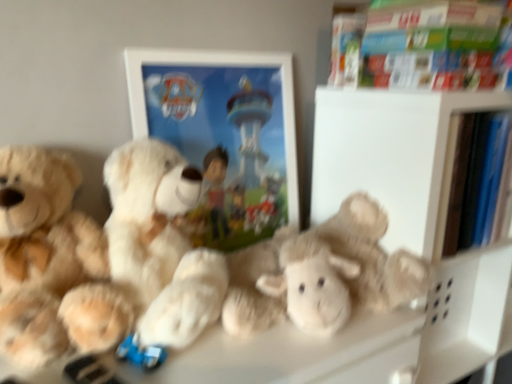
Question: Considering the relative sizes of soft plush teddy bear at left, which ranks as the 3th teddy bear in right-to-left order, and hardcover book at upper right in the image provided, is soft plush teddy bear at left, which ranks as the 3th teddy bear in right-to-left order, smaller than hardcover book at upper right?

Choices:
 (A) yes
 (B) no

Answer: (B)

Question: Is soft plush teddy bear at left, which ranks as the first teddy bear in left-to-right order, directly adjacent to hardcover book at upper right?

Choices:
 (A) no
 (B) yes

Answer: (A)

Question: Is soft plush teddy bear at left, which ranks as the first teddy bear in left-to-right order, oriented away from hardcover book at upper right?

Choices:
 (A) no
 (B) yes

Answer: (A)

Question: Is hardcover book at upper right located within soft plush teddy bear at left, which ranks as the first teddy bear in left-to-right order?

Choices:
 (A) yes
 (B) no

Answer: (B)

Question: Considering the relative sizes of soft plush teddy bear at left, which ranks as the 3th teddy bear in right-to-left order, and hardcover book at upper right in the image provided, is soft plush teddy bear at left, which ranks as the 3th teddy bear in right-to-left order, bigger than hardcover book at upper right?

Choices:
 (A) yes
 (B) no

Answer: (A)

Question: From a real-world perspective, is white matte picture frame at center physically located above or below fluffy white teddy bear at center, which is counted as the second teddy bear, starting from the left?

Choices:
 (A) above
 (B) below

Answer: (A)

Question: From the image's perspective, relative to fluffy white teddy bear at center, which is counted as the second teddy bear, starting from the left, is white matte picture frame at center above or below?

Choices:
 (A) above
 (B) below

Answer: (A)

Question: Is point (251, 140) closer or farther from the camera than point (181, 344)?

Choices:
 (A) farther
 (B) closer

Answer: (A)

Question: Would you say white matte picture frame at center is to the left or to the right of fluffy white teddy bear at center, the second teddy bear from the right, in the picture?

Choices:
 (A) right
 (B) left

Answer: (A)

Question: Is fluffy white teddy bear at center, positioned as the third teddy bear in left-to-right order, bigger or smaller than white matte picture frame at center?

Choices:
 (A) big
 (B) small

Answer: (A)

Question: From a real-world perspective, is fluffy white teddy bear at center, positioned as the third teddy bear in left-to-right order, above or below white matte picture frame at center?

Choices:
 (A) below
 (B) above

Answer: (A)

Question: Which is correct: fluffy white teddy bear at center, which is the 1th teddy bear from right to left, is inside white matte picture frame at center, or outside of it?

Choices:
 (A) inside
 (B) outside

Answer: (B)

Question: In the image, is fluffy white teddy bear at center, positioned as the third teddy bear in left-to-right order, positioned in front of or behind white matte picture frame at center?

Choices:
 (A) behind
 (B) front

Answer: (B)

Question: Which is correct: fluffy white teddy bear at center, positioned as the third teddy bear in left-to-right order, is inside soft plush teddy bear at left, which ranks as the first teddy bear in left-to-right order, or outside of it?

Choices:
 (A) inside
 (B) outside

Answer: (B)

Question: Is fluffy white teddy bear at center, which is the 1th teddy bear from right to left, wider or thinner than soft plush teddy bear at left, which ranks as the 3th teddy bear in right-to-left order?

Choices:
 (A) thin
 (B) wide

Answer: (B)